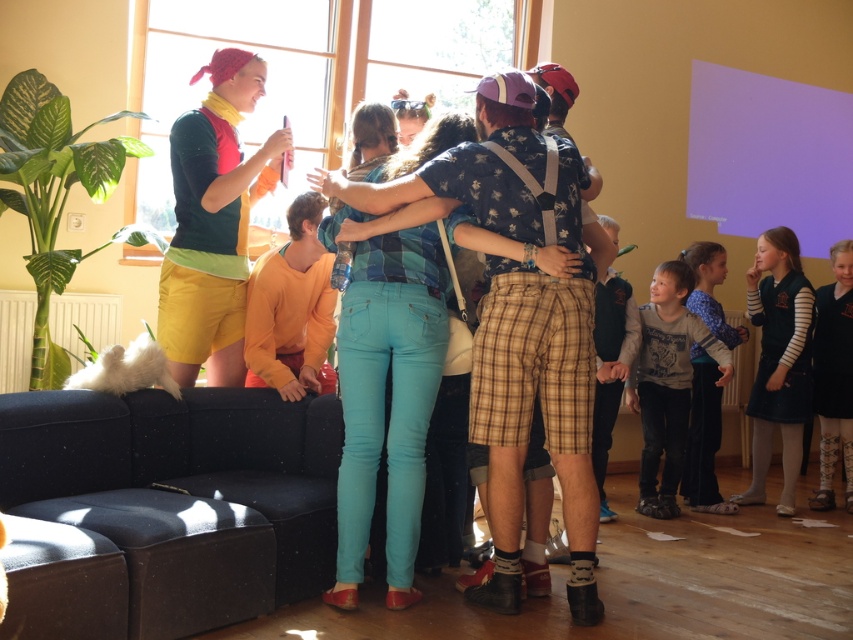
Question: Among these points, which one is nearest to the camera?

Choices:
 (A) (674, 364)
 (B) (88, 442)
 (C) (694, 292)

Answer: (B)

Question: Does denim jeans at center have a lesser width compared to light gray sweater at lower right?

Choices:
 (A) yes
 (B) no

Answer: (B)

Question: Which of the following is the farthest from the observer?

Choices:
 (A) (540, 344)
 (B) (689, 323)

Answer: (B)

Question: Is matte green shorts at left smaller than gray cotton shirt at lower right?

Choices:
 (A) no
 (B) yes

Answer: (A)

Question: Can you confirm if denim jeans at center is bigger than matte green shorts at left?

Choices:
 (A) yes
 (B) no

Answer: (A)

Question: Which object appears closest to the camera in this image?

Choices:
 (A) gray cotton shirt at lower right
 (B) light gray sweater at lower right

Answer: (A)